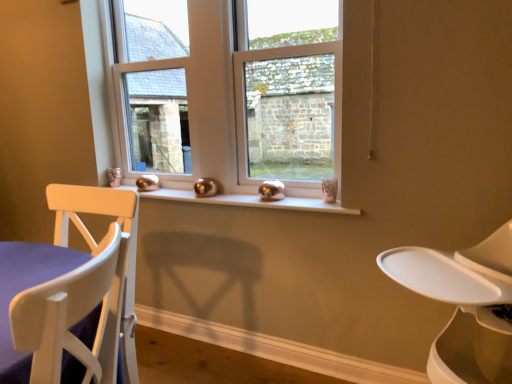
Question: Can you confirm if clear glass window at center is thinner than clear glass window at center?

Choices:
 (A) yes
 (B) no

Answer: (A)

Question: Can you confirm if clear glass window at center is bigger than clear glass window at center?

Choices:
 (A) yes
 (B) no

Answer: (A)

Question: From the image's perspective, would you say clear glass window at center is positioned over clear glass window at center?

Choices:
 (A) no
 (B) yes

Answer: (B)

Question: Is clear glass window at center turned away from clear glass window at center?

Choices:
 (A) no
 (B) yes

Answer: (A)

Question: Would you say clear glass window at center is outside clear glass window at center?

Choices:
 (A) yes
 (B) no

Answer: (A)

Question: Is point (160, 193) positioned closer to the camera than point (457, 317)?

Choices:
 (A) closer
 (B) farther

Answer: (B)

Question: Considering the positions of white glossy window sill at center and white plastic feeding chair at right in the image, is white glossy window sill at center taller or shorter than white plastic feeding chair at right?

Choices:
 (A) short
 (B) tall

Answer: (A)

Question: Which is correct: white glossy window sill at center is inside white plastic feeding chair at right, or outside of it?

Choices:
 (A) inside
 (B) outside

Answer: (B)

Question: Considering the positions of white glossy window sill at center and white plastic feeding chair at right in the image, is white glossy window sill at center wider or thinner than white plastic feeding chair at right?

Choices:
 (A) thin
 (B) wide

Answer: (A)

Question: From the image's perspective, is white glossy window sill at center positioned above or below clear glass window at center?

Choices:
 (A) above
 (B) below

Answer: (B)

Question: Considering the positions of point (161, 190) and point (239, 52), is point (161, 190) closer or farther from the camera than point (239, 52)?

Choices:
 (A) farther
 (B) closer

Answer: (A)

Question: In the image, is white glossy window sill at center positioned in front of or behind clear glass window at center?

Choices:
 (A) behind
 (B) front

Answer: (B)

Question: Would you say white glossy window sill at center is to the left or to the right of clear glass window at center in the picture?

Choices:
 (A) left
 (B) right

Answer: (A)

Question: From the image's perspective, is white plastic feeding chair at right above or below clear glass window at center?

Choices:
 (A) above
 (B) below

Answer: (B)

Question: In the image, is white plastic feeding chair at right positioned in front of or behind clear glass window at center?

Choices:
 (A) behind
 (B) front

Answer: (B)